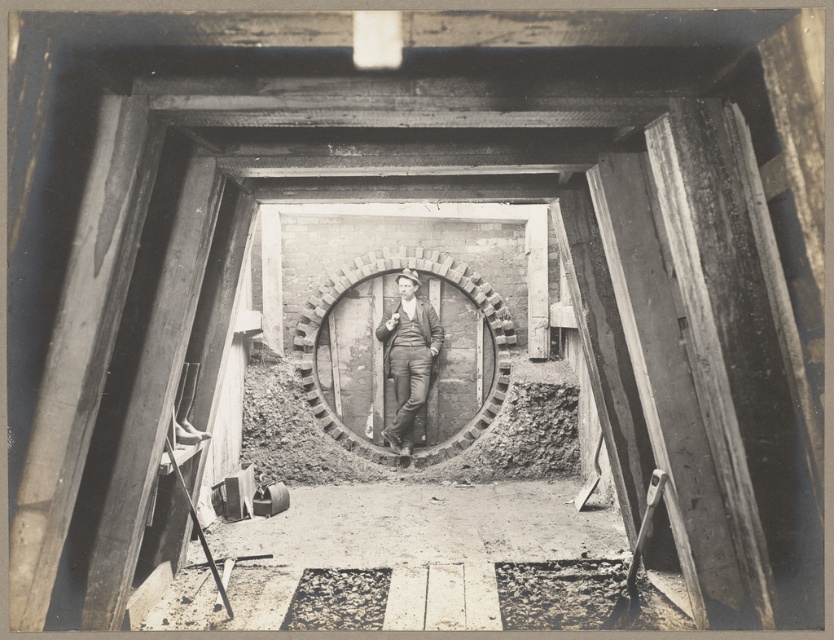
Can you confirm if brick at center is wider than matte black suit at center?

Indeed, brick at center has a greater width compared to matte black suit at center.

Can you confirm if brick at center is bigger than matte black suit at center?

Correct, brick at center is larger in size than matte black suit at center.

Is point (490, 321) more distant than point (402, 368)?

No, (490, 321) is in front of (402, 368).

This screenshot has height=640, width=834. Find the location of `brick at center`. brick at center is located at coordinates (380, 278).